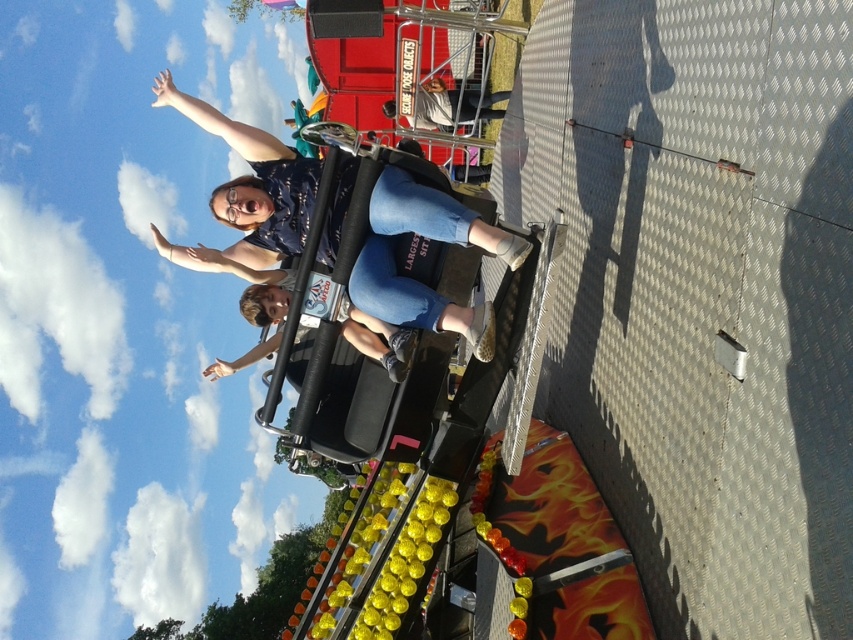
You are standing at the entrance of the amusement park and see two points in the bumper car ride. Which point, point (289, 196) or point (386, 336), is closer to you?

Point (289, 196) is further to the camera than point (386, 336), so the point closer to you is point (386, 336).

You are standing at the entrance of the fairground and see the light brown leather jacket at center. If you walk straight ahead, will you pass by the bumper car ride first before reaching the jacket?

The light brown leather jacket at center is located at point (259, 316), which is in the center of the image. Since the bumper car ride is the focal point and positioned centrally as well, walking straight ahead would lead you towards both simultaneously. However, since the jacket is part of the scene on the ride, you would encounter the bumper car ride first before reaching the jacket.

You are trying to locate the denim jeans at center in the image. What are the coordinates where you can find them?

The denim jeans at center can be found at coordinates point [415,280].